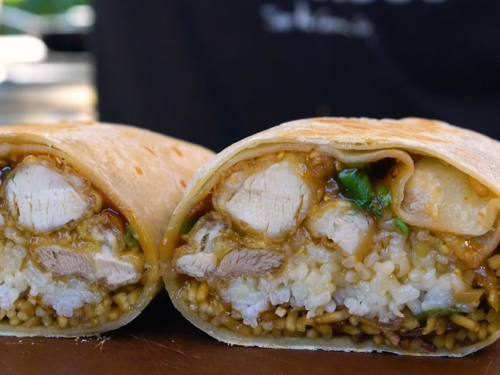
Identify the location of background wall. Image resolution: width=500 pixels, height=375 pixels. (372, 86).